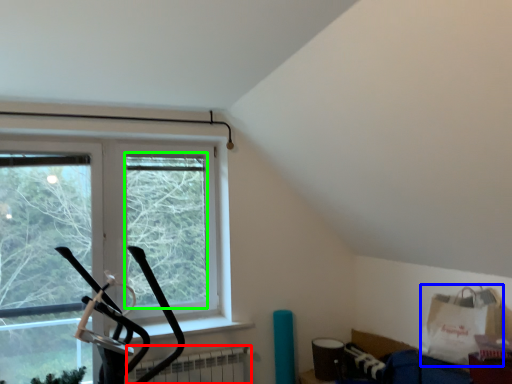
Question: Which is nearer to the radiator (highlighted by a red box)? grocery bag (highlighted by a blue box) or window screen (highlighted by a green box).

Choices:
 (A) grocery bag
 (B) window screen

Answer: (B)